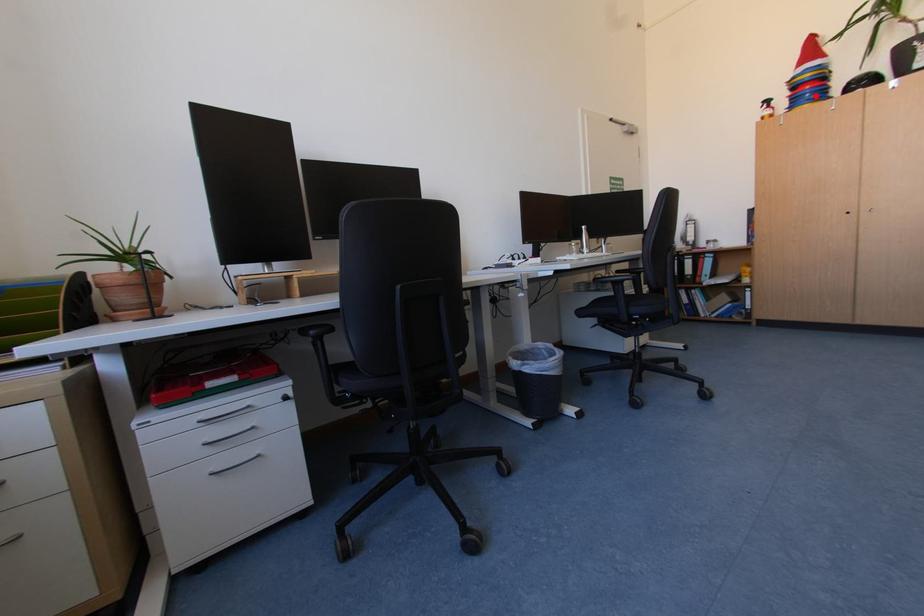
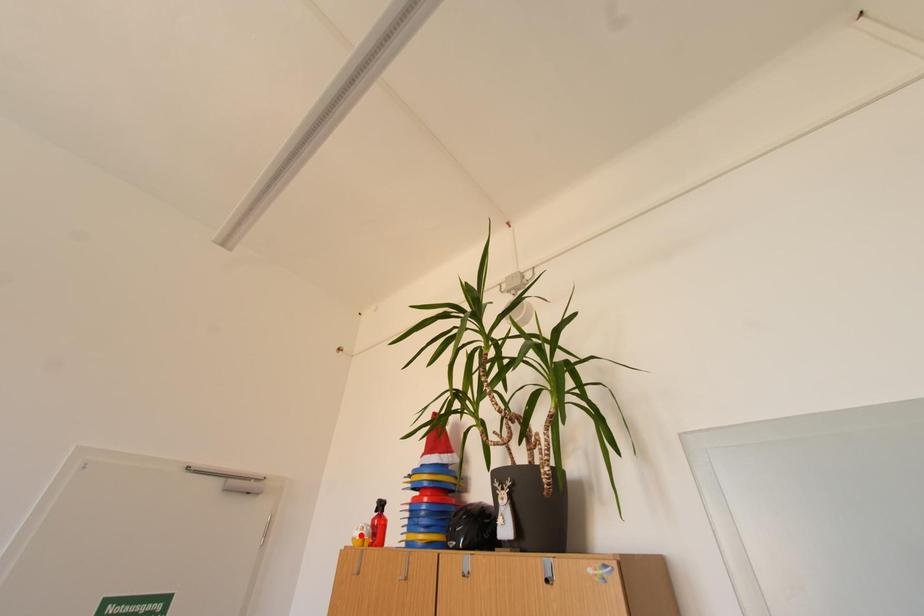
I am providing you with two images of the same scene from different viewpoints. A red point is marked on the first image and another point is marked on the second image. Is the marked point in image1 the same physical position as the marked point in image2?

No